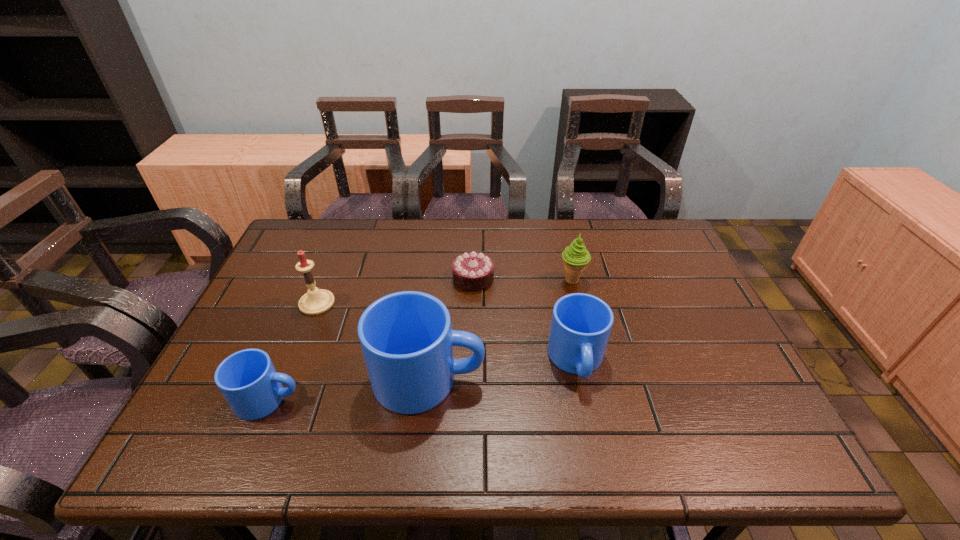
The image size is (960, 540). I want to click on vacant space located 0.070m on the back of the candle, so click(x=328, y=275).

You are a GUI agent. You are given a task and a screenshot of the screen. Output one action in this format:
    pyautogui.click(x=<x>, y=<y>)
    Task: Click on the vacant space located 0.200m on the left of the shortest object
    The width and height of the screenshot is (960, 540).
    Given the screenshot: What is the action you would take?
    pyautogui.click(x=385, y=278)

You are a GUI agent. You are given a task and a screenshot of the screen. Output one action in this format:
    pyautogui.click(x=<x>, y=<y>)
    Task: Click on the vacant position located 0.170m on the left of the icecream
    The height and width of the screenshot is (540, 960).
    Given the screenshot: What is the action you would take?
    pyautogui.click(x=500, y=281)

This screenshot has height=540, width=960. I want to click on mug present at the left edge, so click(247, 379).

This screenshot has width=960, height=540. Identify the location of candle situated at the left edge. (316, 301).

Identify the location of object at the near left corner. pyautogui.click(x=247, y=379).

In the image, there is a desktop. In order to click on vacant area at the far edge in this screenshot , I will do `click(560, 220)`.

Find the location of `vacant area at the near edge of the desktop`. vacant area at the near edge of the desktop is located at coordinates (502, 405).

Image resolution: width=960 pixels, height=540 pixels. In order to click on vacant space at the left edge in this screenshot , I will do `click(264, 338)`.

The width and height of the screenshot is (960, 540). In the image, there is a desktop. What are the coordinates of `vacant space at the right edge` in the screenshot? It's located at (658, 300).